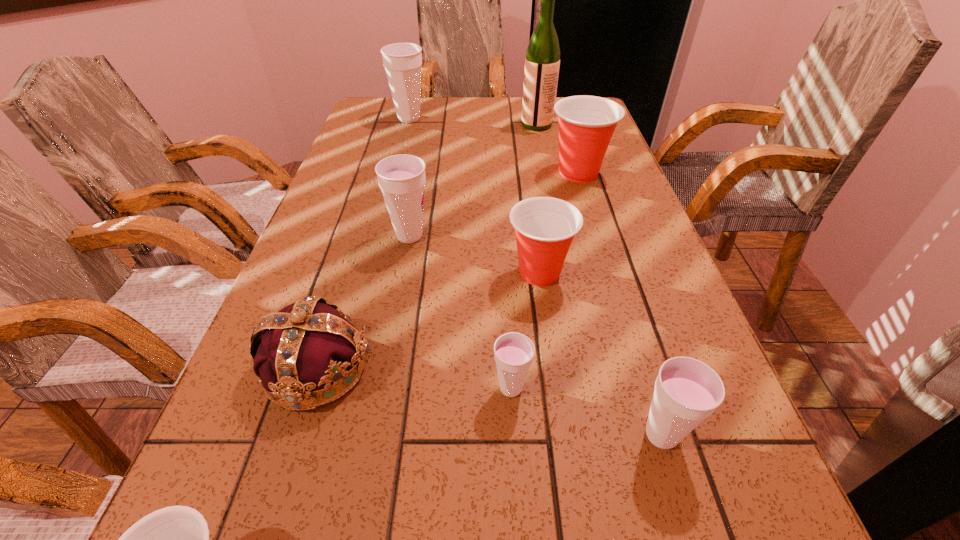
Where is `the second smallest purple cup`? This screenshot has height=540, width=960. the second smallest purple cup is located at coordinates (687, 391).

Identify the location of the second biggest red cup. The image size is (960, 540). (544, 226).

The width and height of the screenshot is (960, 540). I want to click on the fifth farthest object, so click(x=544, y=226).

Identify the location of the second purple cup from right to left. The image size is (960, 540). 513,352.

Find the location of `the fifth farthest cup`. the fifth farthest cup is located at coordinates (513, 352).

Locate an element on the screen. free spot located 0.150m on the label of the tallest object is located at coordinates (475, 125).

Locate an element on the screen. free point located 0.050m on the label of the tallest object is located at coordinates (506, 125).

This screenshot has height=540, width=960. Identify the location of vacant position located 0.240m on the label of the tallest object. (447, 125).

The width and height of the screenshot is (960, 540). What are the coordinates of `vacant space situated on the right of the farthest purple cup` in the screenshot? It's located at (533, 118).

Identify the location of vacant region located 0.140m on the back of the farthest red cup. (566, 134).